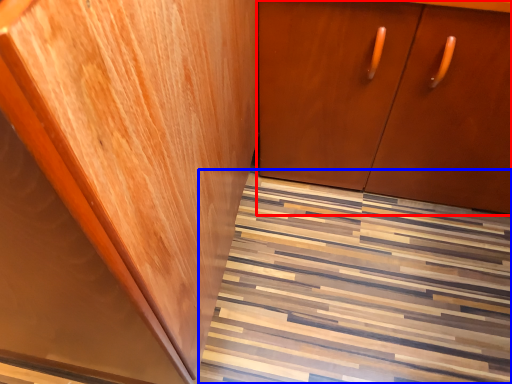
Question: Which object is closer to the camera taking this photo, cabinetry (highlighted by a red box) or stairwell (highlighted by a blue box)?

Choices:
 (A) cabinetry
 (B) stairwell

Answer: (A)